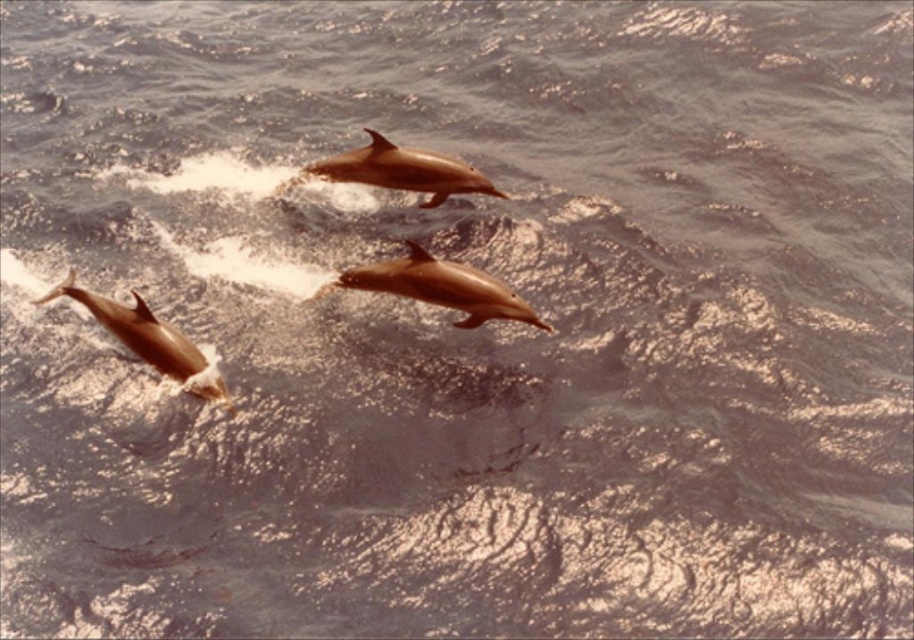
Question: Which object is closer to the camera taking this photo?

Choices:
 (A) smooth brown dolphin at center
 (B) light brown smooth dolphin at lower left
 (C) shiny brown dolphin at center

Answer: (B)

Question: Among these objects, which one is nearest to the camera?

Choices:
 (A) shiny brown dolphin at center
 (B) smooth brown dolphin at center

Answer: (A)

Question: Does shiny brown dolphin at center have a smaller size compared to light brown smooth dolphin at lower left?

Choices:
 (A) no
 (B) yes

Answer: (B)

Question: Can you confirm if smooth brown dolphin at center is wider than light brown smooth dolphin at lower left?

Choices:
 (A) no
 (B) yes

Answer: (B)

Question: Does shiny brown dolphin at center come in front of light brown smooth dolphin at lower left?

Choices:
 (A) yes
 (B) no

Answer: (B)

Question: Which point is closer to the camera?

Choices:
 (A) smooth brown dolphin at center
 (B) light brown smooth dolphin at lower left

Answer: (B)